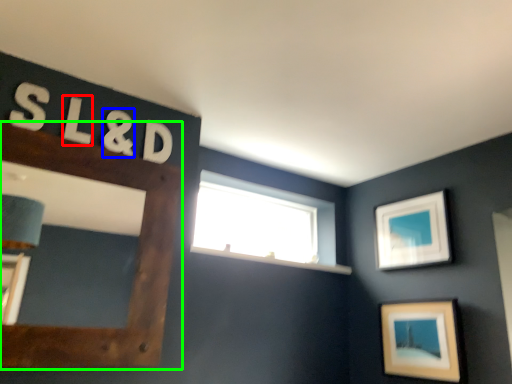
Question: Which is nearer to the letter (highlighted by a red box)? number (highlighted by a blue box) or picture frame (highlighted by a green box).

Choices:
 (A) number
 (B) picture frame

Answer: (A)